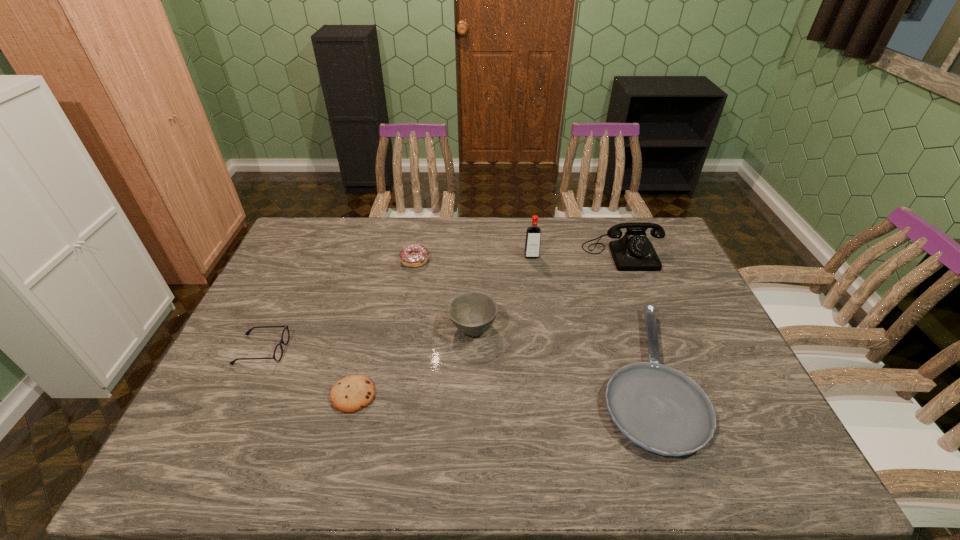
Select which object appears as the fourth closest to the spectacles. Please provide its 2D coordinates. Your answer should be formatted as a tuple, i.e. [(x, y)], where the tuple contains the x and y coordinates of a point satisfying the conditions above.

[(533, 233)]

Find the location of a particular element. object that is the fourth closest to the spectacles is located at coordinates (533, 233).

Where is `free region that satisfies the following two spatial constraints: 1. on the front face of the telephone; 2. on the front-facing side of the leftmost object`? This screenshot has height=540, width=960. free region that satisfies the following two spatial constraints: 1. on the front face of the telephone; 2. on the front-facing side of the leftmost object is located at coordinates (660, 350).

At what (x,y) coordinates should I click in order to perform the action: click on free space in the image that satisfies the following two spatial constraints: 1. on the front-facing side of the leftmost object; 2. on the back side of the frying pan. Please return your answer as a coordinate pair (x, y). The height and width of the screenshot is (540, 960). Looking at the image, I should click on (250, 376).